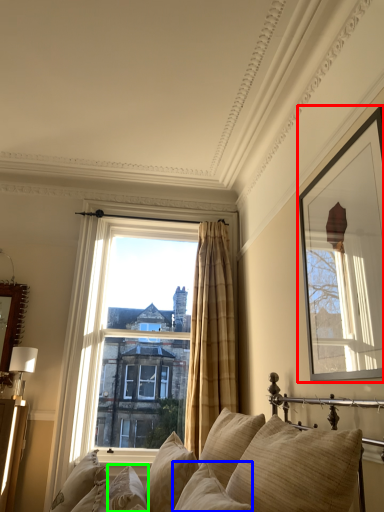
Question: Which is nearer to the picture frame (highlighted by a red box)? pillow (highlighted by a blue box) or pillow (highlighted by a green box).

Choices:
 (A) pillow
 (B) pillow

Answer: (A)